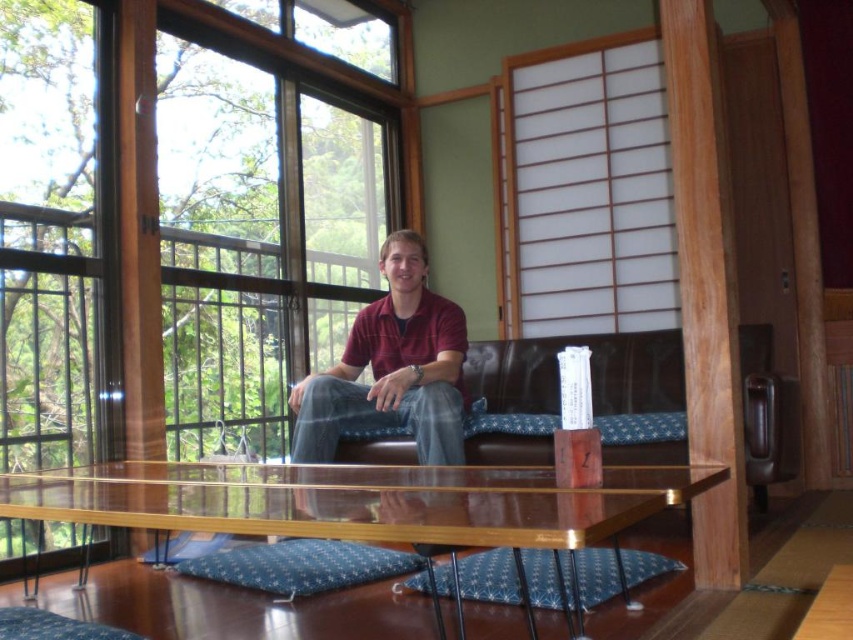
Question: Which of the following is the closest to the observer?

Choices:
 (A) transparent glass table at center
 (B) maroon shirt at center
 (C) clear glass window at upper left
 (D) white paper screen at upper right

Answer: (A)

Question: Based on their relative distances, which object is farther from the brown leather couch at center?

Choices:
 (A) clear glass window at upper left
 (B) maroon shirt at center
 (C) transparent glass table at center
 (D) white paper screen at upper right

Answer: (A)

Question: Can you confirm if clear glass window at upper left is positioned above brown leather couch at center?

Choices:
 (A) yes
 (B) no

Answer: (A)

Question: Based on their relative distances, which object is farther from the clear glass window at upper left?

Choices:
 (A) white paper screen at upper right
 (B) transparent glass table at center
 (C) maroon shirt at center

Answer: (B)

Question: Does clear glass window at upper left appear on the left side of brown leather couch at center?

Choices:
 (A) no
 (B) yes

Answer: (B)

Question: Does clear glass window at upper left have a lesser width compared to brown leather couch at center?

Choices:
 (A) yes
 (B) no

Answer: (A)